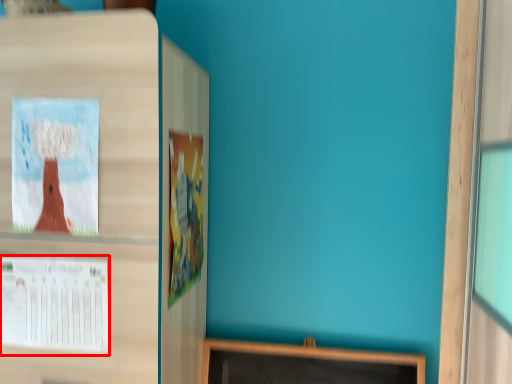
Question: From the image, what is the correct spatial relationship of poster (annotated by the red box) in relation to poster?

Choices:
 (A) left
 (B) right

Answer: (A)